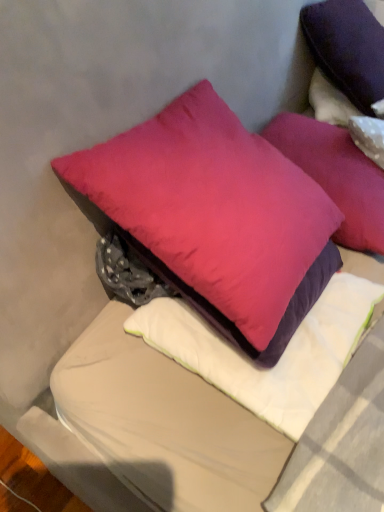
Find the location of `purple matte pillow at upper right, placed as the 4th pillow when sorted from bottom to top`. purple matte pillow at upper right, placed as the 4th pillow when sorted from bottom to top is located at coordinates (347, 117).

What do you see at coordinates (280, 358) in the screenshot? This screenshot has height=512, width=384. I see `satin purple pillow at center, arranged as the 1th pillow when ordered from the bottom` at bounding box center [280, 358].

I want to click on purple matte pillow at upper right, the second pillow from the top, so (347, 117).

Does matte pink pillow at center, the second pillow in the bottom-to-top sequence, appear on the left side of matte pink pillow at center, which is the 3th pillow from top to bottom?

Correct, you'll find matte pink pillow at center, the second pillow in the bottom-to-top sequence, to the left of matte pink pillow at center, which is the 3th pillow from top to bottom.

Who is taller, matte pink pillow at center, the second pillow in the bottom-to-top sequence, or matte pink pillow at center, which is the 3th pillow from top to bottom?

With more height is matte pink pillow at center, the second pillow in the bottom-to-top sequence.

This screenshot has height=512, width=384. In order to click on the 2nd pillow behind the matte pink pillow at center, positioned as the 4th pillow in top-to-bottom order, starting your count from the anchor in this screenshot , I will do `click(336, 175)`.

Based on the photo, from a real-world perspective, is purple matte pillow at upper right, placed as the 4th pillow when sorted from bottom to top, on satin purple pillow at center, the 5th pillow when ordered from top to bottom?

Indeed, from a real-world perspective, purple matte pillow at upper right, placed as the 4th pillow when sorted from bottom to top, stands above satin purple pillow at center, the 5th pillow when ordered from top to bottom.

Is purple matte pillow at upper right, placed as the 4th pillow when sorted from bottom to top, to the left of satin purple pillow at center, arranged as the 1th pillow when ordered from the bottom, from the viewer's perspective?

No.

The height and width of the screenshot is (512, 384). What are the coordinates of `pillow that is under the purple matte pillow at upper right, the second pillow from the top (from a real-world perspective)` in the screenshot? It's located at (280, 358).

How many degrees apart are the facing directions of purple matte pillow at upper right, placed as the 4th pillow when sorted from bottom to top, and satin purple pillow at center, the 5th pillow when ordered from top to bottom?

They differ by 36 degrees in their facing directions.

Where is `pillow that is the 2nd one when counting downward from the matte pink pillow at center, which is the 3th pillow from top to bottom (from the image's perspective)`? pillow that is the 2nd one when counting downward from the matte pink pillow at center, which is the 3th pillow from top to bottom (from the image's perspective) is located at coordinates (280, 358).

Does satin purple pillow at center, arranged as the 1th pillow when ordered from the bottom, have a greater height compared to matte pink pillow at center, which is the 3th pillow from top to bottom?

No, satin purple pillow at center, arranged as the 1th pillow when ordered from the bottom, is not taller than matte pink pillow at center, which is the 3th pillow from top to bottom.

Can we say satin purple pillow at center, arranged as the 1th pillow when ordered from the bottom, lies outside matte pink pillow at center, marked as the third pillow in a bottom-to-top arrangement?

Yes, satin purple pillow at center, arranged as the 1th pillow when ordered from the bottom, is located beyond the bounds of matte pink pillow at center, marked as the third pillow in a bottom-to-top arrangement.

Identify the location of the 1st pillow above the satin purple pillow at center, arranged as the 1th pillow when ordered from the bottom (from the image's perspective). (212, 206).

Is satin purple pillow at center, the 5th pillow when ordered from top to bottom, a part of matte pink pillow at center, positioned as the 4th pillow in top-to-bottom order?

That's incorrect, satin purple pillow at center, the 5th pillow when ordered from top to bottom, is not inside matte pink pillow at center, positioned as the 4th pillow in top-to-bottom order.

Considering the sizes of matte pink pillow at center, the second pillow in the bottom-to-top sequence, and satin purple pillow at center, arranged as the 1th pillow when ordered from the bottom, in the image, is matte pink pillow at center, the second pillow in the bottom-to-top sequence, wider or thinner than satin purple pillow at center, arranged as the 1th pillow when ordered from the bottom,?

Considering their sizes, matte pink pillow at center, the second pillow in the bottom-to-top sequence, looks broader than satin purple pillow at center, arranged as the 1th pillow when ordered from the bottom.

From a real-world perspective, who is located lower, matte pink pillow at center, positioned as the 4th pillow in top-to-bottom order, or satin purple pillow at center, the 5th pillow when ordered from top to bottom?

satin purple pillow at center, the 5th pillow when ordered from top to bottom, is physically lower.

Considering the relative positions of purple velvet pillow at upper right, marked as the 5th pillow in a bottom-to-top arrangement, and satin purple pillow at center, arranged as the 1th pillow when ordered from the bottom, in the image provided, is purple velvet pillow at upper right, marked as the 5th pillow in a bottom-to-top arrangement, to the left of satin purple pillow at center, arranged as the 1th pillow when ordered from the bottom, from the viewer's perspective?

Incorrect, purple velvet pillow at upper right, marked as the 5th pillow in a bottom-to-top arrangement, is not on the left side of satin purple pillow at center, arranged as the 1th pillow when ordered from the bottom.

Considering the sizes of objects purple velvet pillow at upper right, placed as the first pillow when sorted from top to bottom, and satin purple pillow at center, arranged as the 1th pillow when ordered from the bottom, in the image provided, who is taller, purple velvet pillow at upper right, placed as the first pillow when sorted from top to bottom, or satin purple pillow at center, arranged as the 1th pillow when ordered from the bottom,?

purple velvet pillow at upper right, placed as the first pillow when sorted from top to bottom.

Considering the sizes of objects purple velvet pillow at upper right, placed as the first pillow when sorted from top to bottom, and satin purple pillow at center, the 5th pillow when ordered from top to bottom, in the image provided, who is smaller, purple velvet pillow at upper right, placed as the first pillow when sorted from top to bottom, or satin purple pillow at center, the 5th pillow when ordered from top to bottom,?

Smaller between the two is satin purple pillow at center, the 5th pillow when ordered from top to bottom.

Could you measure the distance between purple velvet pillow at upper right, marked as the 5th pillow in a bottom-to-top arrangement, and satin purple pillow at center, arranged as the 1th pillow when ordered from the bottom?

purple velvet pillow at upper right, marked as the 5th pillow in a bottom-to-top arrangement, is 29.90 inches away from satin purple pillow at center, arranged as the 1th pillow when ordered from the bottom.

Can you tell me how much satin purple pillow at center, the 5th pillow when ordered from top to bottom, and purple matte pillow at upper right, placed as the 4th pillow when sorted from bottom to top, differ in facing direction?

36 degrees separate the facing orientations of satin purple pillow at center, the 5th pillow when ordered from top to bottom, and purple matte pillow at upper right, placed as the 4th pillow when sorted from bottom to top.

Which is behind, point (311, 386) or point (332, 98)?

The point (332, 98) is farther from the camera.

Is satin purple pillow at center, the 5th pillow when ordered from top to bottom, far from purple matte pillow at upper right, the second pillow from the top?

satin purple pillow at center, the 5th pillow when ordered from top to bottom, is actually quite close to purple matte pillow at upper right, the second pillow from the top.

Is the position of matte pink pillow at center, which is the 3th pillow from top to bottom, more distant than that of satin purple pillow at center, the 5th pillow when ordered from top to bottom?

That is True.

Starting from the matte pink pillow at center, marked as the third pillow in a bottom-to-top arrangement, which pillow is the 1st one to the left? Please provide its 2D coordinates.

[(280, 358)]

Is satin purple pillow at center, the 5th pillow when ordered from top to bottom, a part of matte pink pillow at center, marked as the third pillow in a bottom-to-top arrangement?

No.

Who is bigger, matte pink pillow at center, which is the 3th pillow from top to bottom, or satin purple pillow at center, the 5th pillow when ordered from top to bottom?

With larger size is matte pink pillow at center, which is the 3th pillow from top to bottom.

The height and width of the screenshot is (512, 384). In order to click on the 2nd pillow to the left of the matte pink pillow at center, which is the 3th pillow from top to bottom, starting your count from the anchor in this screenshot , I will do `click(212, 206)`.

Locate an element on the screen. The width and height of the screenshot is (384, 512). pillow that is the 3rd one when counting upward from the satin purple pillow at center, arranged as the 1th pillow when ordered from the bottom (from the image's perspective) is located at coordinates (347, 117).

From the image, which object appears to be farther from matte pink pillow at center, marked as the third pillow in a bottom-to-top arrangement, satin purple pillow at center, the 5th pillow when ordered from top to bottom, or purple matte pillow at upper right, placed as the 4th pillow when sorted from bottom to top?

Among the two, satin purple pillow at center, the 5th pillow when ordered from top to bottom, is located further to matte pink pillow at center, marked as the third pillow in a bottom-to-top arrangement.

Which object lies further to the anchor point matte pink pillow at center, the second pillow in the bottom-to-top sequence, purple matte pillow at upper right, placed as the 4th pillow when sorted from bottom to top, or purple velvet pillow at upper right, marked as the 5th pillow in a bottom-to-top arrangement?

purple velvet pillow at upper right, marked as the 5th pillow in a bottom-to-top arrangement, is positioned further to the anchor matte pink pillow at center, the second pillow in the bottom-to-top sequence.

From the image, which object appears to be farther from satin purple pillow at center, the 5th pillow when ordered from top to bottom, matte pink pillow at center, the second pillow in the bottom-to-top sequence, or matte pink pillow at center, marked as the third pillow in a bottom-to-top arrangement?

Based on the image, matte pink pillow at center, marked as the third pillow in a bottom-to-top arrangement, appears to be further to satin purple pillow at center, the 5th pillow when ordered from top to bottom.

Considering their positions, is satin purple pillow at center, arranged as the 1th pillow when ordered from the bottom, positioned closer to purple velvet pillow at upper right, marked as the 5th pillow in a bottom-to-top arrangement, than purple matte pillow at upper right, the second pillow from the top?

purple matte pillow at upper right, the second pillow from the top, lies closer to purple velvet pillow at upper right, marked as the 5th pillow in a bottom-to-top arrangement, than the other object.

Considering their positions, is purple matte pillow at upper right, the second pillow from the top, positioned further to matte pink pillow at center, marked as the third pillow in a bottom-to-top arrangement, than matte pink pillow at center, the second pillow in the bottom-to-top sequence?

Among the two, matte pink pillow at center, the second pillow in the bottom-to-top sequence, is located further to matte pink pillow at center, marked as the third pillow in a bottom-to-top arrangement.

Based on their spatial positions, is matte pink pillow at center, positioned as the 4th pillow in top-to-bottom order, or purple velvet pillow at upper right, placed as the first pillow when sorted from top to bottom, further from purple matte pillow at upper right, placed as the 4th pillow when sorted from bottom to top?

matte pink pillow at center, positioned as the 4th pillow in top-to-bottom order.

Based on their spatial positions, is matte pink pillow at center, which is the 3th pillow from top to bottom, or purple matte pillow at upper right, the second pillow from the top, closer to satin purple pillow at center, arranged as the 1th pillow when ordered from the bottom?

matte pink pillow at center, which is the 3th pillow from top to bottom.

Which object lies further to the anchor point satin purple pillow at center, arranged as the 1th pillow when ordered from the bottom, matte pink pillow at center, the second pillow in the bottom-to-top sequence, or purple matte pillow at upper right, placed as the 4th pillow when sorted from bottom to top?

purple matte pillow at upper right, placed as the 4th pillow when sorted from bottom to top.

The width and height of the screenshot is (384, 512). I want to click on pillow between purple velvet pillow at upper right, placed as the first pillow when sorted from top to bottom, and matte pink pillow at center, marked as the third pillow in a bottom-to-top arrangement, vertically, so (347, 117).

Locate an element on the screen. This screenshot has width=384, height=512. pillow between matte pink pillow at center, the second pillow in the bottom-to-top sequence, and matte pink pillow at center, marked as the third pillow in a bottom-to-top arrangement, along the z-axis is located at coordinates coord(280,358).